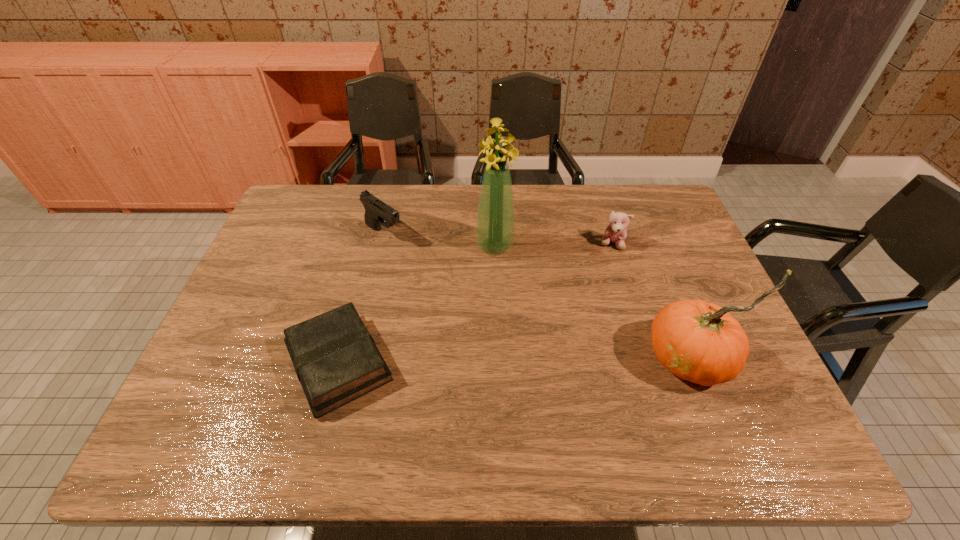
This screenshot has width=960, height=540. I want to click on vacant area that lies between the third object from left to right and the second tallest object, so click(x=593, y=302).

The height and width of the screenshot is (540, 960). What are the coordinates of `blank region between the fourth shortest object and the bouquet` in the screenshot? It's located at (593, 302).

You are a GUI agent. You are given a task and a screenshot of the screen. Output one action in this format:
    pyautogui.click(x=<x>, y=<y>)
    Task: Click on the vacant area that lies between the pistol and the third object from left to right
    The height and width of the screenshot is (540, 960).
    Given the screenshot: What is the action you would take?
    pyautogui.click(x=440, y=240)

Image resolution: width=960 pixels, height=540 pixels. Find the location of `vacant space that's between the teddy bear and the book`. vacant space that's between the teddy bear and the book is located at coordinates pos(475,303).

The height and width of the screenshot is (540, 960). What are the coordinates of `vacant area that lies between the second tallest object and the teddy bear` in the screenshot? It's located at (652, 301).

The width and height of the screenshot is (960, 540). I want to click on empty location between the pistol and the pumpkin, so click(x=538, y=296).

What are the coordinates of `vacant area between the pumpkin and the shortest object` in the screenshot? It's located at (515, 361).

Identify which object is located as the second nearest to the bouquet. Please provide its 2D coordinates. Your answer should be formatted as a tuple, i.e. [(x, y)], where the tuple contains the x and y coordinates of a point satisfying the conditions above.

[(616, 233)]

Identify the location of object that is the closest one to the pumpkin. Image resolution: width=960 pixels, height=540 pixels. click(616, 233).

Identify the location of vacant space that satisfies the following two spatial constraints: 1. on the back side of the teddy bear; 2. on the right side of the bouquet. This screenshot has width=960, height=540. (494, 244).